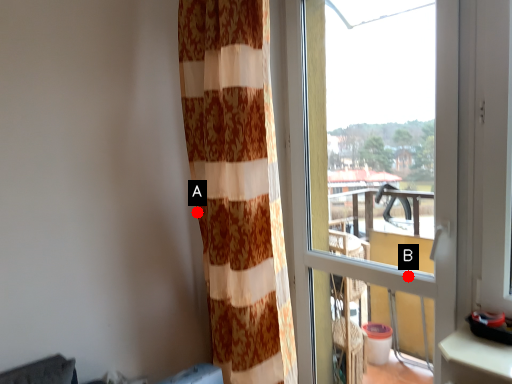
Question: Two points are circled on the image, labeled by A and B beside each circle. Which point is closer to the camera?

Choices:
 (A) A is closer
 (B) B is closer

Answer: (B)